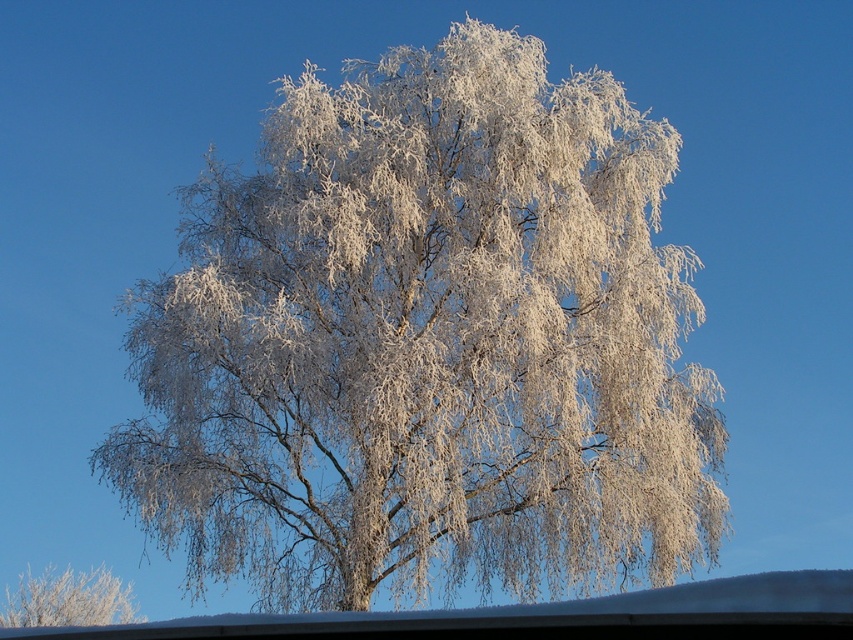
You are an artist trying to sketch the scene. You notice two elements in the image. The first is the white frosty birch tree at center, and the second is the frosted white branches at lower left. Based on their positions, which one is closer to the left edge of the image?

The frosted white branches at lower left are closer to the left edge of the image because the white frosty birch tree at center is to the right of them.

You are standing in front of the winter scene and want to touch both points on the tree. Which point, point [308,364] or point [44,618], is closer to you?

Point [308,364] is closer to the viewer than point [44,618].

You are standing in the winter scene and want to take a photo of the white frosty birch tree at center. Where should you position yourself to ensure the tree is centered in your camera viewfinder?

The white frosty birch tree at center is positioned at coordinates point (x=428, y=346), so you should align your camera viewfinder to that point to center the tree.